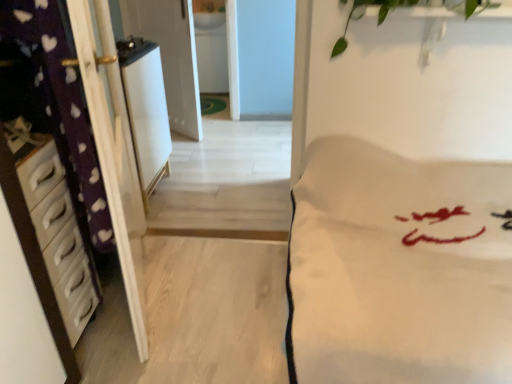
Question: Is white plastic chest of drawers at left directly adjacent to white glossy sink at upper center?

Choices:
 (A) yes
 (B) no

Answer: (B)

Question: Is white plastic chest of drawers at left wider than white glossy sink at upper center?

Choices:
 (A) yes
 (B) no

Answer: (B)

Question: Is white glossy sink at upper center surrounded by white plastic chest of drawers at left?

Choices:
 (A) yes
 (B) no

Answer: (B)

Question: Can you confirm if white plastic chest of drawers at left is taller than white glossy sink at upper center?

Choices:
 (A) yes
 (B) no

Answer: (A)

Question: From a real-world perspective, is white plastic chest of drawers at left positioned under white glossy sink at upper center based on gravity?

Choices:
 (A) no
 (B) yes

Answer: (B)

Question: Considering the positions of white soft fabric at center and white glossy refrigerator at center in the image, is white soft fabric at center wider or thinner than white glossy refrigerator at center?

Choices:
 (A) wide
 (B) thin

Answer: (A)

Question: Is white soft fabric at center inside the boundaries of white glossy refrigerator at center, or outside?

Choices:
 (A) inside
 (B) outside

Answer: (B)

Question: From a real-world perspective, is white soft fabric at center above or below white glossy refrigerator at center?

Choices:
 (A) below
 (B) above

Answer: (A)

Question: Is white soft fabric at center bigger or smaller than white glossy refrigerator at center?

Choices:
 (A) small
 (B) big

Answer: (B)

Question: Based on their positions, is white glossy refrigerator at center located to the left or right of white glossy screen door at upper center?

Choices:
 (A) right
 (B) left

Answer: (A)

Question: Is point (145, 140) positioned closer to the camera than point (172, 62)?

Choices:
 (A) farther
 (B) closer

Answer: (B)

Question: Choose the correct answer: Is white glossy refrigerator at center inside white glossy screen door at upper center or outside it?

Choices:
 (A) inside
 (B) outside

Answer: (B)

Question: From the image's perspective, is white glossy refrigerator at center above or below white glossy screen door at upper center?

Choices:
 (A) below
 (B) above

Answer: (A)

Question: Looking at the image, does white glossy screen door at upper center seem bigger or smaller compared to white glossy sink at upper center?

Choices:
 (A) big
 (B) small

Answer: (A)

Question: From a real-world perspective, relative to white glossy sink at upper center, is white glossy screen door at upper center vertically above or below?

Choices:
 (A) below
 (B) above

Answer: (A)